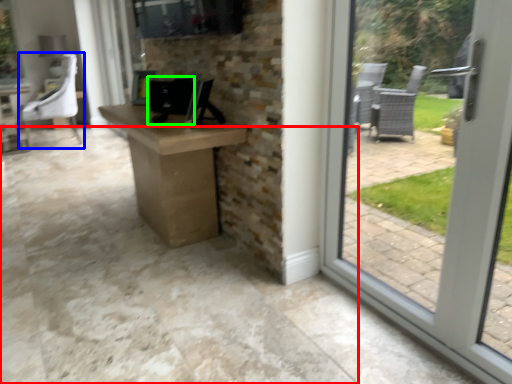
Question: Considering the real-world distances, which object is closest to concrete (highlighted by a red box)? chair (highlighted by a blue box) or desktop computer (highlighted by a green box).

Choices:
 (A) chair
 (B) desktop computer

Answer: (B)